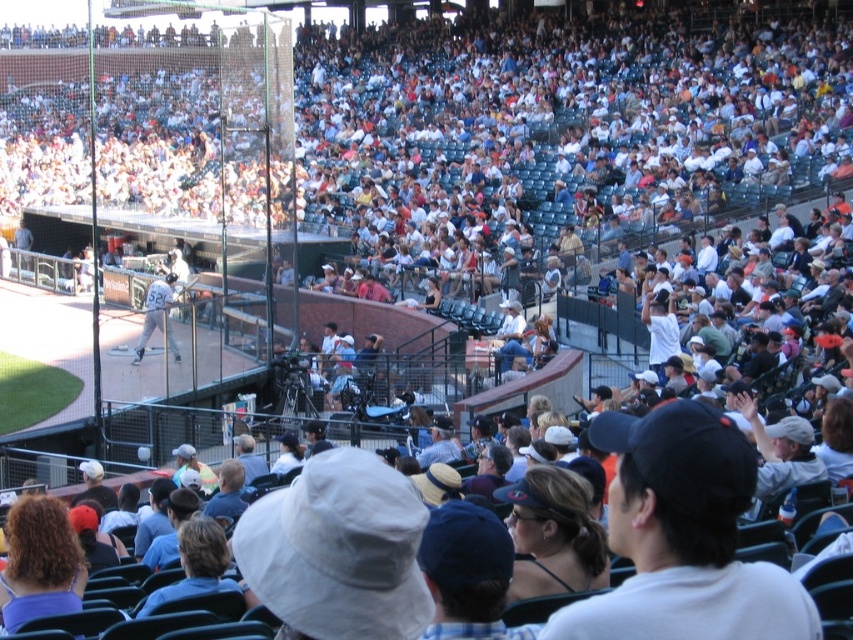
Please describe the location of the light brown hair at lower center in the image using the coordinate system provided in the description.

The light brown hair at lower center is located at point coordinates of 0.883 on the x axis and 0.231 on the y axis.

You are a photographer standing at the edge of the baseball field. You want to take a closeup shot of the light brown hair at lower center. The camera you have can focus up to 100 feet. Will you be able to capture a clear closeup?

The light brown hair at lower center is 107.28 feet away from the viewer. Since the camera can only focus up to 100 feet, it will not be able to capture a clear closeup.